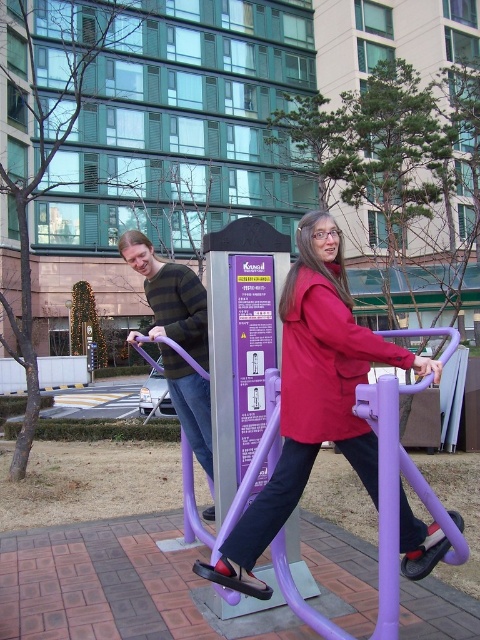
You are a photographer trying to capture a photo of the matte red jacket at center and striped sweater at center. Since you want to ensure both are fully visible, which one should you focus on first to avoid cropping out the taller one?

The striped sweater at center is taller than the matte red jacket at center, so you should focus on ensuring the striped sweater at center is fully visible first to avoid cropping it out.

You are standing at point (x=396, y=496) in the park. What object are you standing on?

You are standing on the purple plastic exercise machine at center located at point (x=396, y=496).